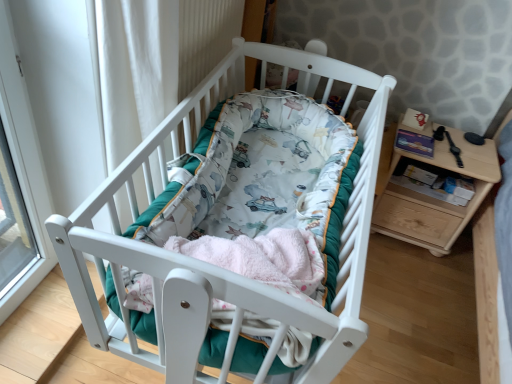
Question: In terms of width, does wooden changing table at right look wider or thinner when compared to white wood crib at center?

Choices:
 (A) thin
 (B) wide

Answer: (A)

Question: Choose the correct answer: Is wooden changing table at right inside white wood crib at center or outside it?

Choices:
 (A) outside
 (B) inside

Answer: (A)

Question: Based on their relative distances, which object is farther from the wooden changing table at right?

Choices:
 (A) fluffy pink blanket at center
 (B) white wood crib at center
 (C) black leather watch at right

Answer: (A)

Question: Which object is positioned closest to the wooden changing table at right?

Choices:
 (A) fluffy pink blanket at center
 (B) black leather watch at right
 (C) white wood crib at center

Answer: (B)